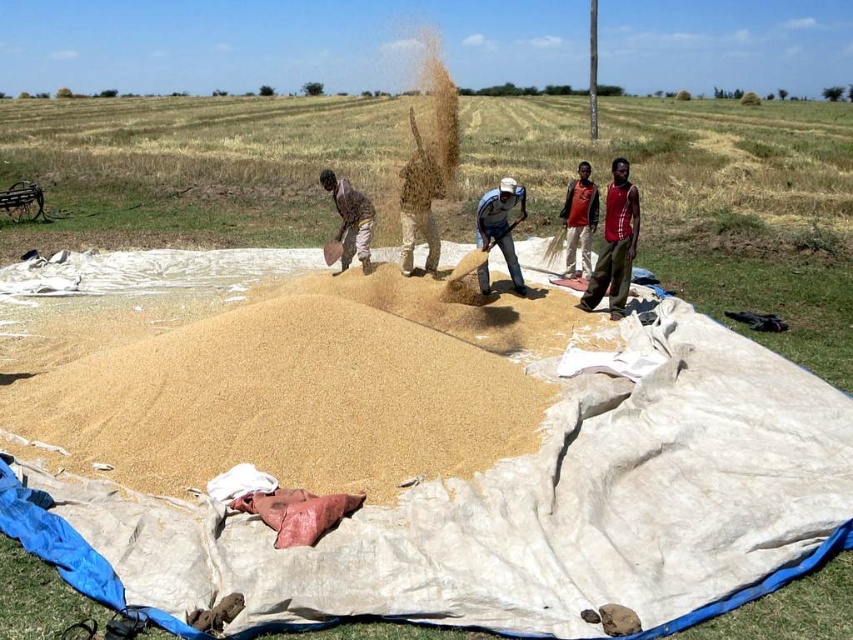
Question: Considering the real-world distances, which object is farthest from the golden sand at center?

Choices:
 (A) red fabric shirt at center
 (B) light blue fabric at center
 (C) red sleeveless shirt at right

Answer: (A)

Question: Can you confirm if golden sand at center is positioned to the right of brown fabric bag at center?

Choices:
 (A) no
 (B) yes

Answer: (A)

Question: Which of the following is the closest to the observer?

Choices:
 (A) red fabric shirt at center
 (B) golden sand at center
 (C) brown fabric bag at center
 (D) light blue fabric at center

Answer: (B)

Question: Is light blue fabric at center to the left of brown fabric bag at center from the viewer's perspective?

Choices:
 (A) no
 (B) yes

Answer: (A)

Question: Can you confirm if golden sand at center is positioned to the right of red sleeveless shirt at right?

Choices:
 (A) no
 (B) yes

Answer: (A)

Question: Which object appears closest to the camera in this image?

Choices:
 (A) red sleeveless shirt at right
 (B) red fabric shirt at center
 (C) light blue fabric at center

Answer: (A)